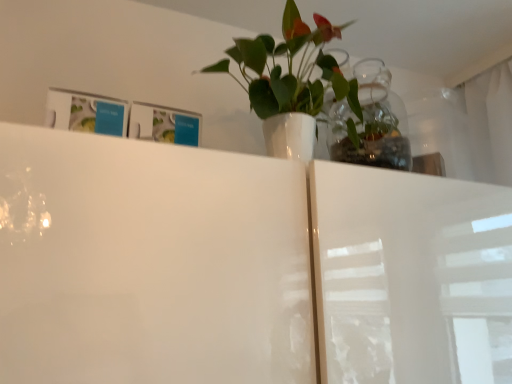
Question: From the image's perspective, would you say transparent glass vase at upper center is shown under white glossy vase at upper center?

Choices:
 (A) yes
 (B) no

Answer: (A)

Question: Does transparent glass vase at upper center have a greater width compared to white glossy vase at upper center?

Choices:
 (A) yes
 (B) no

Answer: (B)

Question: Considering the relative positions of transparent glass vase at upper center and white glossy vase at upper center in the image provided, is transparent glass vase at upper center behind white glossy vase at upper center?

Choices:
 (A) no
 (B) yes

Answer: (B)

Question: Does transparent glass vase at upper center have a lesser width compared to white glossy vase at upper center?

Choices:
 (A) yes
 (B) no

Answer: (A)

Question: From a real-world perspective, is transparent glass vase at upper center located beneath white glossy vase at upper center?

Choices:
 (A) yes
 (B) no

Answer: (A)

Question: Is transparent glass vase at upper center positioned in front of white glossy vase at upper center?

Choices:
 (A) no
 (B) yes

Answer: (A)

Question: Is white glossy vase at upper center not close to transparent glass vase at upper center?

Choices:
 (A) yes
 (B) no

Answer: (B)

Question: Considering the relative sizes of white glossy vase at upper center and transparent glass vase at upper center in the image provided, is white glossy vase at upper center wider than transparent glass vase at upper center?

Choices:
 (A) yes
 (B) no

Answer: (A)

Question: Considering the relative sizes of white glossy vase at upper center and transparent glass vase at upper center in the image provided, is white glossy vase at upper center taller than transparent glass vase at upper center?

Choices:
 (A) no
 (B) yes

Answer: (B)

Question: Can you confirm if white glossy vase at upper center is smaller than transparent glass vase at upper center?

Choices:
 (A) yes
 (B) no

Answer: (B)

Question: Is white glossy vase at upper center next to transparent glass vase at upper center?

Choices:
 (A) no
 (B) yes

Answer: (A)

Question: Is white glossy vase at upper center outside of transparent glass vase at upper center?

Choices:
 (A) yes
 (B) no

Answer: (A)

Question: Do you think transparent glass vase at upper center is within white glossy vase at upper center, or outside of it?

Choices:
 (A) outside
 (B) inside

Answer: (A)